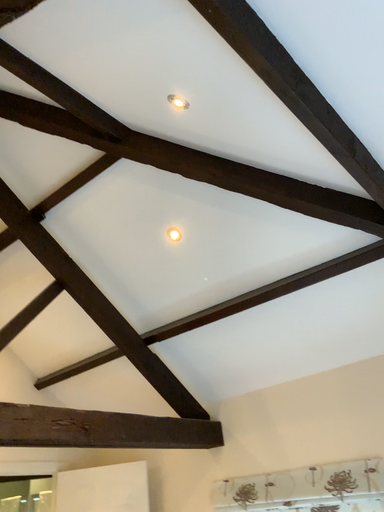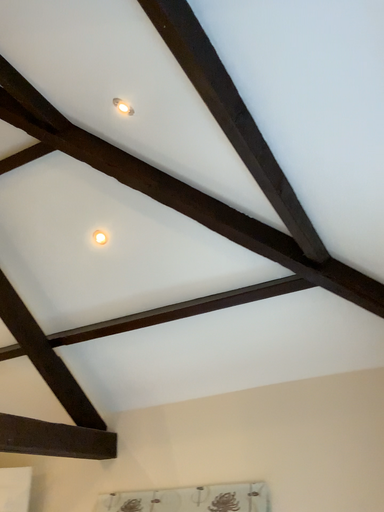
Question: Which way did the camera rotate in the video?

Choices:
 (A) rotated right
 (B) rotated left

Answer: (A)